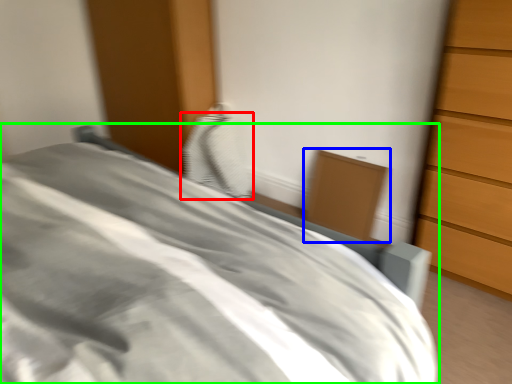
Question: Which object is positioned farthest from pillow (highlighted by a red box)? Select from cabinetry (highlighted by a blue box) and bed (highlighted by a green box).

Choices:
 (A) cabinetry
 (B) bed

Answer: (B)